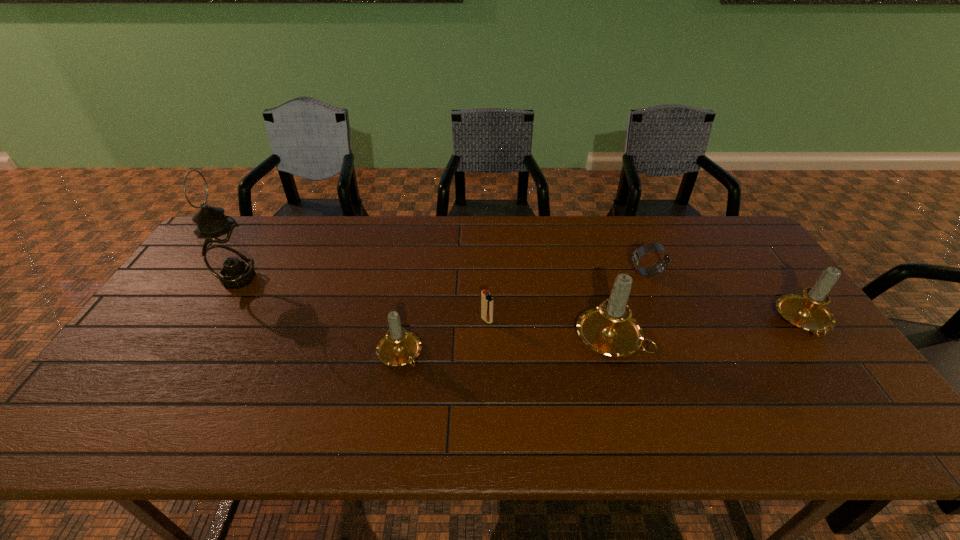
This screenshot has width=960, height=540. I want to click on object that is at the right edge, so click(x=807, y=311).

Find the location of a particular element. The width and height of the screenshot is (960, 540). vacant space at the far edge is located at coordinates (628, 222).

In order to click on vacant space at the near edge of the desktop in this screenshot , I will do `click(322, 376)`.

At what (x,y) coordinates should I click in order to perform the action: click on vacant region at the left edge of the desktop. Please return your answer as a coordinate pair (x, y). The height and width of the screenshot is (540, 960). Looking at the image, I should click on (125, 367).

Locate an element on the screen. vacant space at the right edge of the desktop is located at coordinates (782, 325).

In the image, there is a desktop. Where is `vacant region at the far left corner`? The image size is (960, 540). vacant region at the far left corner is located at coordinates (245, 238).

Image resolution: width=960 pixels, height=540 pixels. In order to click on blank space at the near right corner of the desktop in this screenshot , I will do `click(830, 402)`.

What are the coordinates of `free space between the rightmost candle and the oil lamp` in the screenshot? It's located at (521, 301).

Locate an element on the screen. The height and width of the screenshot is (540, 960). free space between the tallest candle and the tallest object is located at coordinates (423, 308).

At what (x,y) coordinates should I click in order to perform the action: click on free spot between the second tallest candle and the second tallest object. Please return your answer as a coordinate pair (x, y). Looking at the image, I should click on (x=707, y=330).